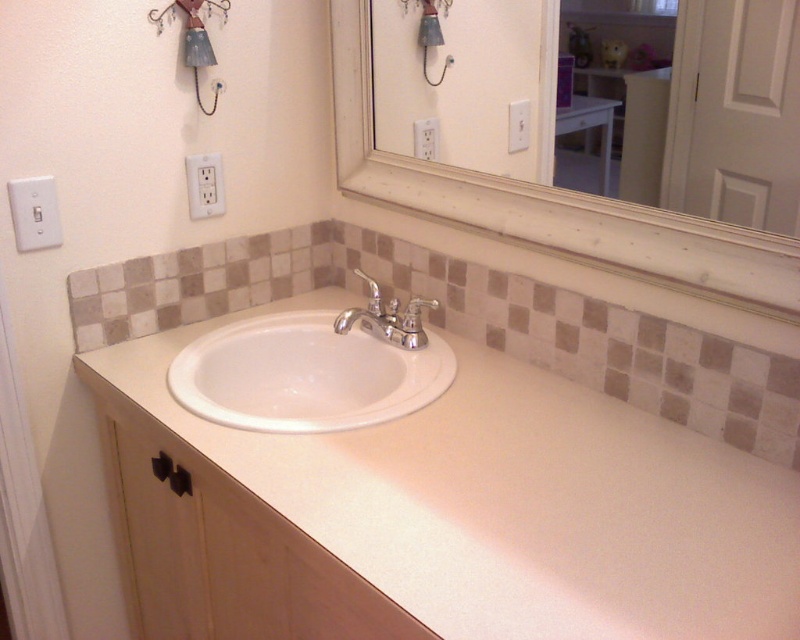
Between white glossy vanity at upper center and white plastic outlet at upper left, which one is positioned higher?

white glossy vanity at upper center is above.

Can you confirm if white glossy vanity at upper center is positioned below white plastic outlet at upper left?

No, white glossy vanity at upper center is not below white plastic outlet at upper left.

The image size is (800, 640). What do you see at coordinates (590, 128) in the screenshot?
I see `white glossy vanity at upper center` at bounding box center [590, 128].

At what (x,y) coordinates should I click in order to perform the action: click on white glossy vanity at upper center. Please return your answer as a coordinate pair (x, y). This screenshot has width=800, height=640. Looking at the image, I should click on (590, 128).

Does white ceramic sink at center appear over white plastic outlet at upper center?

Actually, white ceramic sink at center is below white plastic outlet at upper center.

Who is more forward, (x=384, y=355) or (x=418, y=148)?

Point (x=384, y=355)

Find the location of a particular element. The height and width of the screenshot is (640, 800). white ceramic sink at center is located at coordinates (314, 369).

Can you confirm if white ceramic sink at center is smaller than chrome/metallic faucet at center?

No.

Is white ceramic sink at center below chrome/metallic faucet at center?

Yes, white ceramic sink at center is below chrome/metallic faucet at center.

Find the location of a particular element. This screenshot has height=640, width=800. white ceramic sink at center is located at coordinates (314, 369).